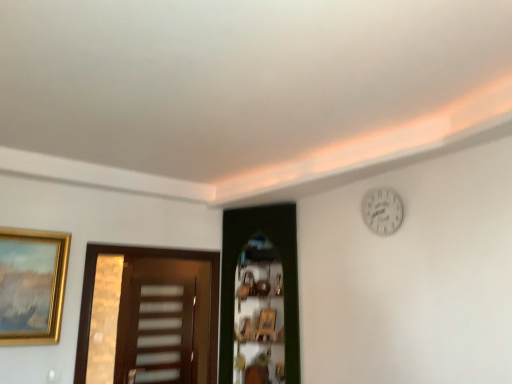
Question: Should I look upward or downward to see white matte clock at upper right?

Choices:
 (A) down
 (B) up

Answer: (A)

Question: Is green wooden door at center, which ranks as the second door in left-to-right order, at the right side of gold metallic picture frame at left?

Choices:
 (A) yes
 (B) no

Answer: (A)

Question: Is green wooden door at center, which ranks as the second door in left-to-right order, positioned far away from gold metallic picture frame at left?

Choices:
 (A) yes
 (B) no

Answer: (A)

Question: Considering the relative sizes of green wooden door at center, which ranks as the 1th door in right-to-left order, and gold metallic picture frame at left in the image provided, is green wooden door at center, which ranks as the 1th door in right-to-left order, shorter than gold metallic picture frame at left?

Choices:
 (A) yes
 (B) no

Answer: (B)

Question: Is green wooden door at center, which ranks as the 1th door in right-to-left order, positioned behind gold metallic picture frame at left?

Choices:
 (A) yes
 (B) no

Answer: (A)

Question: Does green wooden door at center, which ranks as the 1th door in right-to-left order, appear on the left side of gold metallic picture frame at left?

Choices:
 (A) no
 (B) yes

Answer: (A)

Question: Does green wooden door at center, which ranks as the second door in left-to-right order, have a greater width compared to gold metallic picture frame at left?

Choices:
 (A) yes
 (B) no

Answer: (A)

Question: Does gold metallic picture frame at left have a larger size compared to white matte clock at upper right?

Choices:
 (A) no
 (B) yes

Answer: (B)

Question: Is gold metallic picture frame at left at the left side of white matte clock at upper right?

Choices:
 (A) no
 (B) yes

Answer: (B)

Question: Could you tell me if gold metallic picture frame at left is turned towards white matte clock at upper right?

Choices:
 (A) yes
 (B) no

Answer: (B)

Question: From a real-world perspective, is gold metallic picture frame at left under white matte clock at upper right?

Choices:
 (A) no
 (B) yes

Answer: (B)

Question: Is gold metallic picture frame at left oriented away from white matte clock at upper right?

Choices:
 (A) no
 (B) yes

Answer: (A)

Question: Is gold metallic picture frame at left not within white matte clock at upper right?

Choices:
 (A) no
 (B) yes

Answer: (B)

Question: Can you confirm if green wooden door at center, which ranks as the 1th door in right-to-left order, is thinner than brown wooden door at left, which appears as the first door when viewed from the left?

Choices:
 (A) no
 (B) yes

Answer: (A)